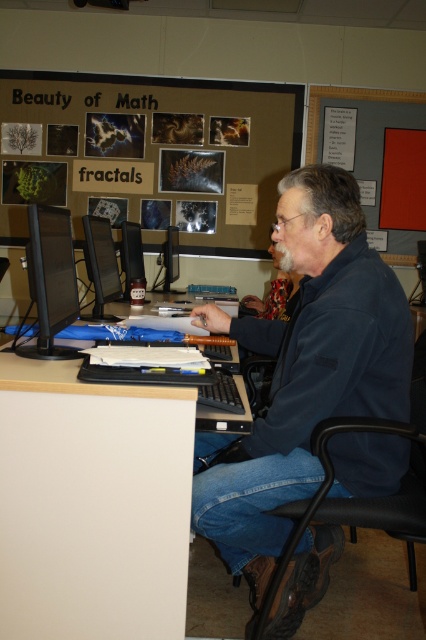
You are a worker who needs to reach the matte black monitor at center but there is a smooth gray poster at upper right blocking your view. Can you move the poster to access the monitor?

The smooth gray poster at upper right is positioned over matte black monitor at center, so moving the poster would allow access to the monitor.

In the scene shown: You are standing at the desk and want to place a new item at the point marked as point (365, 125). What object is currently located at that position?

The point (365, 125) corresponds to the smooth gray poster at upper right.